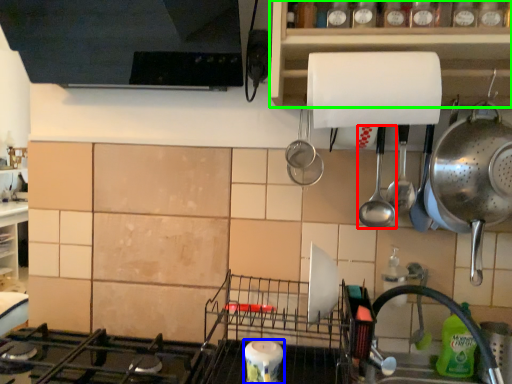
Question: Which is farther away from spoon (highlighted by a red box)? appliance (highlighted by a blue box) or cabinetry (highlighted by a green box)?

Choices:
 (A) appliance
 (B) cabinetry

Answer: (A)